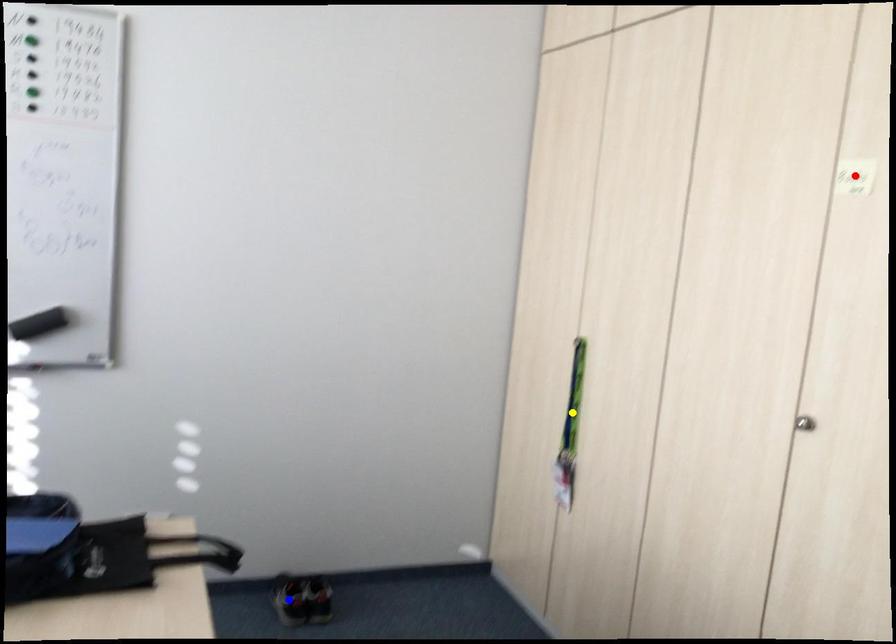
Order these from nearest to farthest:
A) blue point
B) yellow point
C) red point

1. blue point
2. yellow point
3. red point